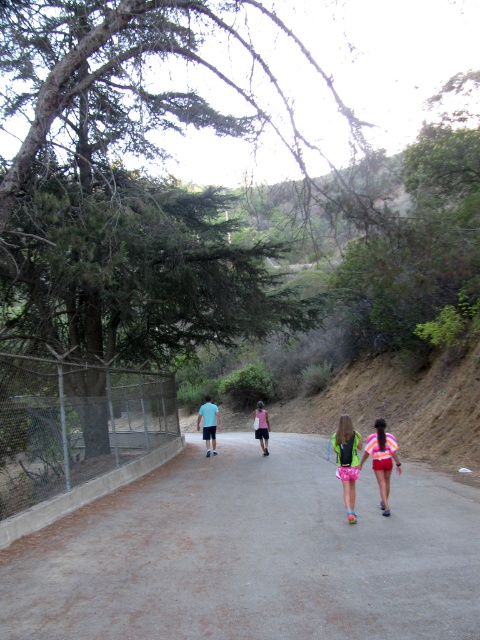
The image size is (480, 640). Find the location of `gray asphalt road at center`. gray asphalt road at center is located at coordinates (252, 554).

Which is below, gray asphalt road at center or pink fabric dress at center?

pink fabric dress at center is lower down.

At what (x,y) coordinates should I click in order to perform the action: click on gray asphalt road at center. Please return your answer as a coordinate pair (x, y). The height and width of the screenshot is (640, 480). Looking at the image, I should click on (252, 554).

How distant is gray asphalt road at center from shiny pink skirt at center?

gray asphalt road at center and shiny pink skirt at center are 3.19 meters apart.

Can you confirm if gray asphalt road at center is taller than shiny pink skirt at center?

No.

Which is behind, point (338, 627) or point (349, 496)?

The point (349, 496) is more distant.

The height and width of the screenshot is (640, 480). Find the location of `gray asphalt road at center`. gray asphalt road at center is located at coordinates (252, 554).

Between shiny pink skirt at center and pink fabric dress at center, which one has less height?

With less height is pink fabric dress at center.

Does shiny pink skirt at center appear over pink fabric dress at center?

Yes, shiny pink skirt at center is above pink fabric dress at center.

Find the location of a particular element. This screenshot has width=480, height=640. shiny pink skirt at center is located at coordinates (347, 461).

I want to click on shiny pink skirt at center, so click(x=347, y=461).